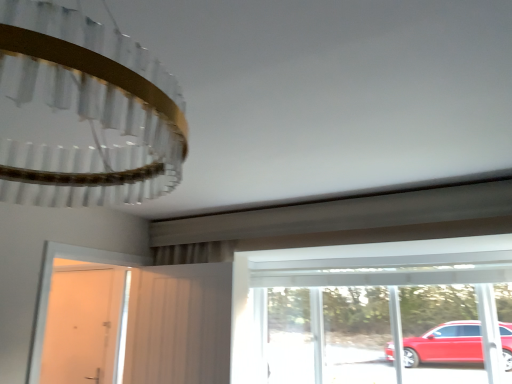
Question: Is white glossy door at left, acting as the 1th door starting from the back, not within white fabric screen door at center?

Choices:
 (A) no
 (B) yes

Answer: (B)

Question: Is white glossy door at left, acting as the 1th door starting from the back, wider than white fabric screen door at center?

Choices:
 (A) no
 (B) yes

Answer: (A)

Question: Does white glossy door at left, positioned as the second door in front-to-back order, have a smaller size compared to white fabric screen door at center?

Choices:
 (A) no
 (B) yes

Answer: (B)

Question: Is white glossy door at left, acting as the 1th door starting from the back, thinner than white fabric screen door at center?

Choices:
 (A) no
 (B) yes

Answer: (B)

Question: Is the position of white glossy door at left, marked as the 1th door in a left-to-right arrangement, more distant than that of white fabric screen door at center?

Choices:
 (A) yes
 (B) no

Answer: (A)

Question: From the image's perspective, is transparent glass window at center located above or below white matte door at left, the second door from the back?

Choices:
 (A) above
 (B) below

Answer: (B)

Question: Visually, is transparent glass window at center positioned to the left or to the right of white matte door at left, arranged as the first door when viewed from the front?

Choices:
 (A) left
 (B) right

Answer: (B)

Question: From a real-world perspective, is transparent glass window at center above or below white matte door at left, placed as the 2th door when sorted from left to right?

Choices:
 (A) below
 (B) above

Answer: (A)

Question: Considering the positions of transparent glass window at center and white matte door at left, the second door from the back, in the image, is transparent glass window at center bigger or smaller than white matte door at left, the second door from the back,?

Choices:
 (A) small
 (B) big

Answer: (B)

Question: From a real-world perspective, relative to transparent glass window at center, is white glossy door at left, marked as the 1th door in a left-to-right arrangement, vertically above or below?

Choices:
 (A) below
 (B) above

Answer: (A)

Question: Considering their positions, is white glossy door at left, marked as the 1th door in a left-to-right arrangement, located in front of or behind transparent glass window at center?

Choices:
 (A) behind
 (B) front

Answer: (A)

Question: Which is correct: white glossy door at left, marked as the 1th door in a left-to-right arrangement, is inside transparent glass window at center, or outside of it?

Choices:
 (A) inside
 (B) outside

Answer: (B)

Question: Considering the positions of white glossy door at left, positioned as the second door in front-to-back order, and transparent glass window at center in the image, is white glossy door at left, positioned as the second door in front-to-back order, taller or shorter than transparent glass window at center?

Choices:
 (A) tall
 (B) short

Answer: (A)

Question: From a real-world perspective, is white matte door at left, placed as the 2th door when sorted from left to right, positioned above or below white glossy door at left, which is the 2th door in right-to-left order?

Choices:
 (A) above
 (B) below

Answer: (A)

Question: Is white matte door at left, the 1th door when ordered from right to left, to the left or to the right of white glossy door at left, acting as the 1th door starting from the back, in the image?

Choices:
 (A) left
 (B) right

Answer: (B)